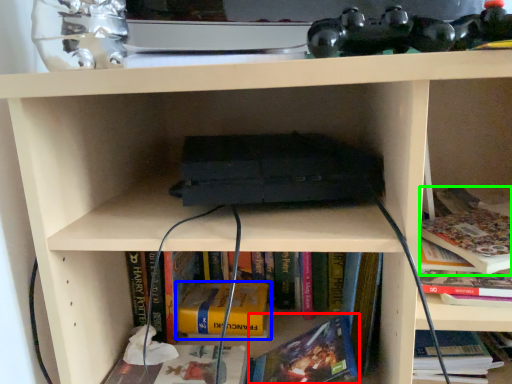
Question: Estimate the real-world distances between objects in this image. Which object is farther from book (highlighted by a red box), book (highlighted by a blue box) or book (highlighted by a green box)?

Choices:
 (A) book
 (B) book

Answer: (B)